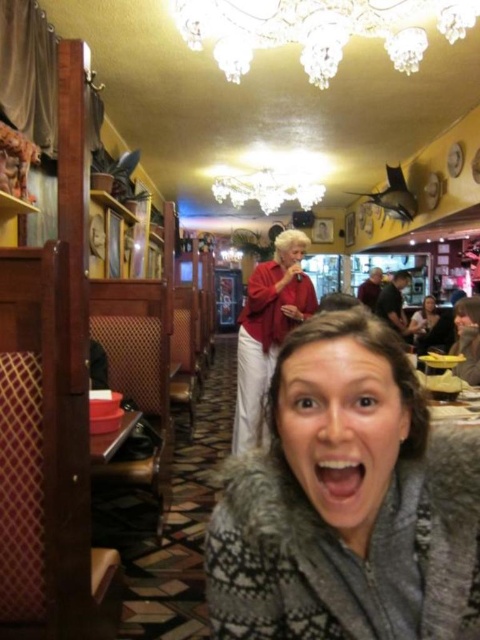
You are a photographer setting up a shoot in this restaurant. You need to position a light source between the fuzzy gray sweater at center and the matte black jacket at lower right. Based on their positions, which side of the jacket should the light be placed?

The fuzzy gray sweater at center is to the left of the matte black jacket at lower right, so the light should be placed to the left side of the matte black jacket at lower right to position it between them.

You are a photographer setting up a shoot in this restaurant. You have a camera with a lens that can focus on objects up to 1 meter thick. You need to decide whether to place your subject in front of the fuzzy gray sweater at center or the shiny crystal chandelier at upper center to ensure proper focus. Which object should you choose?

The fuzzy gray sweater at center is thinner than the shiny crystal chandelier at upper center. Since the camera lens can focus on objects up to 1 meter thick, you should choose the fuzzy gray sweater at center as it is thinner and within the focus range, while the chandelier may exceed the limit.

Consider the image. You are a fashion designer observing a woman in a restaurant wearing two tops. You need to determine which top is shorter between the fuzzy gray sweater at center and the matte red blouse at center. Which one is shorter?

The fuzzy gray sweater at center is shorter than the matte red blouse at center.